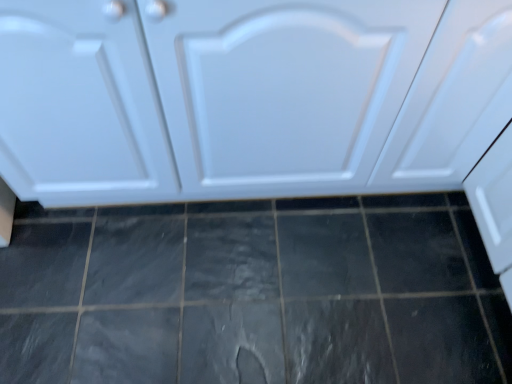
In order to face white glossy cabinet doors at center, should I rotate leftwards or rightwards?

It's best to rotate right around 8.201 degrees.

Find the location of a particular element. The width and height of the screenshot is (512, 384). white glossy cabinet doors at center is located at coordinates (265, 99).

What is the approximate height of white glossy cabinet doors at center?

It is 33.90 inches.

What do you see at coordinates (265, 99) in the screenshot? I see `white glossy cabinet doors at center` at bounding box center [265, 99].

This screenshot has width=512, height=384. Identify the location of white glossy cabinet doors at center. (265, 99).